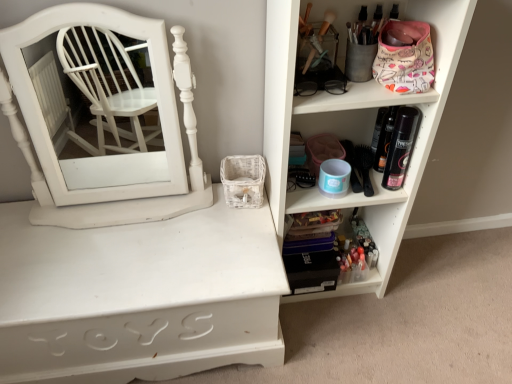
Question: Is white wood medicine cabinet at left aimed at white painted wood shelf at center, which is counted as the 3th shelf, starting from the right?

Choices:
 (A) yes
 (B) no

Answer: (B)

Question: Does white wood medicine cabinet at left lie behind white painted wood shelf at center, marked as the 1th shelf in a left-to-right arrangement?

Choices:
 (A) yes
 (B) no

Answer: (B)

Question: Can you confirm if white wood medicine cabinet at left is bigger than white painted wood shelf at center, which is counted as the 3th shelf, starting from the right?

Choices:
 (A) no
 (B) yes

Answer: (A)

Question: Considering the relative positions of white wood medicine cabinet at left and white painted wood shelf at center, marked as the 1th shelf in a left-to-right arrangement, in the image provided, is white wood medicine cabinet at left to the right of white painted wood shelf at center, marked as the 1th shelf in a left-to-right arrangement, from the viewer's perspective?

Choices:
 (A) yes
 (B) no

Answer: (B)

Question: Does white wood medicine cabinet at left have a greater height compared to white painted wood shelf at center, which is counted as the 3th shelf, starting from the right?

Choices:
 (A) no
 (B) yes

Answer: (B)

Question: From a real-world perspective, is white plastic shelf at upper right, placed as the third shelf when sorted from left to right, physically located above or below white wood medicine cabinet at left?

Choices:
 (A) above
 (B) below

Answer: (B)

Question: Looking at their shapes, would you say white plastic shelf at upper right, placed as the third shelf when sorted from left to right, is wider or thinner than white wood medicine cabinet at left?

Choices:
 (A) wide
 (B) thin

Answer: (A)

Question: Is white plastic shelf at upper right, the first shelf positioned from the right, in front of or behind white wood medicine cabinet at left in the image?

Choices:
 (A) behind
 (B) front

Answer: (B)

Question: From the image's perspective, is white plastic shelf at upper right, the first shelf positioned from the right, above or below white wood medicine cabinet at left?

Choices:
 (A) below
 (B) above

Answer: (A)

Question: In the image, is translucent plastic makeup at lower right, marked as the second shelf in a right-to-left arrangement, on the left side or the right side of white plastic shelf at upper right, placed as the third shelf when sorted from left to right?

Choices:
 (A) left
 (B) right

Answer: (A)

Question: From a real-world perspective, is translucent plastic makeup at lower right, which appears as the second shelf when viewed from the left, positioned above or below white plastic shelf at upper right, placed as the third shelf when sorted from left to right?

Choices:
 (A) below
 (B) above

Answer: (A)

Question: Looking at the image, does translucent plastic makeup at lower right, which appears as the second shelf when viewed from the left, seem bigger or smaller compared to white plastic shelf at upper right, the first shelf positioned from the right?

Choices:
 (A) big
 (B) small

Answer: (B)

Question: Is translucent plastic makeup at lower right, marked as the second shelf in a right-to-left arrangement, inside or outside of white plastic shelf at upper right, the first shelf positioned from the right?

Choices:
 (A) outside
 (B) inside

Answer: (B)

Question: Is white wood medicine cabinet at left inside or outside of white plastic shelf at upper right, the first shelf positioned from the right?

Choices:
 (A) inside
 (B) outside

Answer: (B)

Question: Considering the positions of white wood medicine cabinet at left and white plastic shelf at upper right, the first shelf positioned from the right, in the image, is white wood medicine cabinet at left taller or shorter than white plastic shelf at upper right, the first shelf positioned from the right,?

Choices:
 (A) short
 (B) tall

Answer: (A)